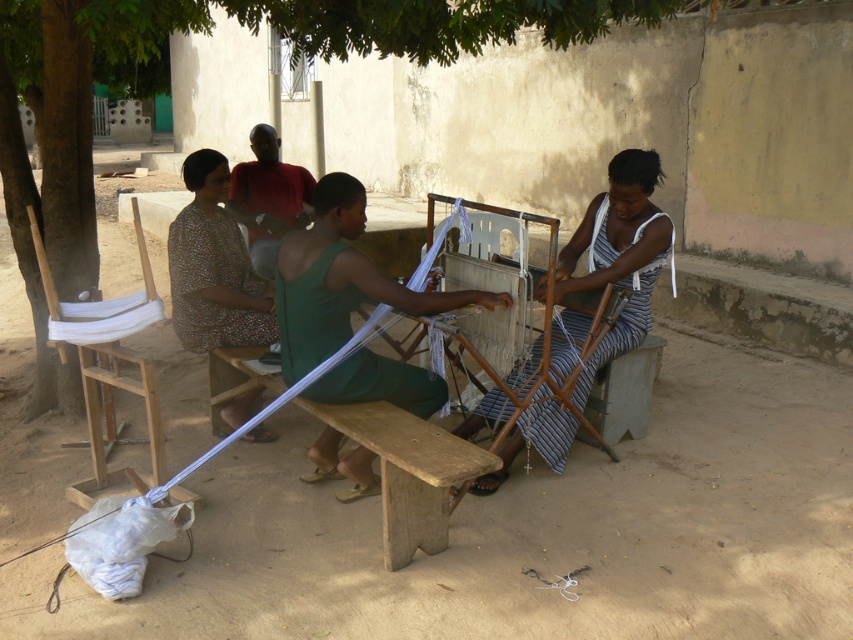
You are a photographer trying to capture the printed fabric dress at center without any obstructions. Given that the green leafy tree at upper left is above it, what should you adjust in your camera angle to ensure the dress is fully visible?

To fully capture the printed fabric dress at center without obstruction from the green leafy tree at upper left, you should lower your camera angle since the tree is positioned above the dress.

You are a customer at a local market and see two fabrics displayed in the image. The green fabric at center and the printed fabric dress at center. Which fabric is placed lower in the image?

The green fabric at center is located below the printed fabric dress at center, so it is placed lower in the image.